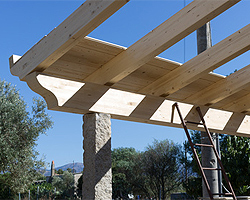
The width and height of the screenshot is (250, 200). Identify the location of center-right beam. (195, 69).